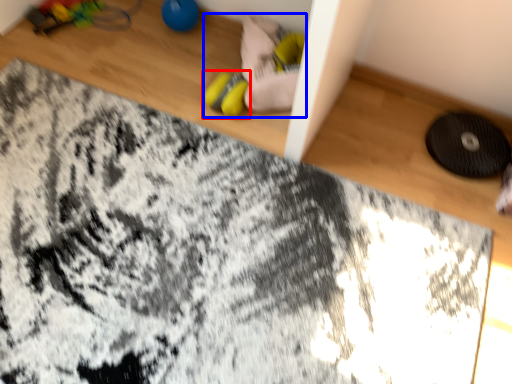
Question: Which object appears farthest to the camera in this image, footwear (highlighted by a red box) or toy (highlighted by a blue box)?

Choices:
 (A) footwear
 (B) toy

Answer: (A)